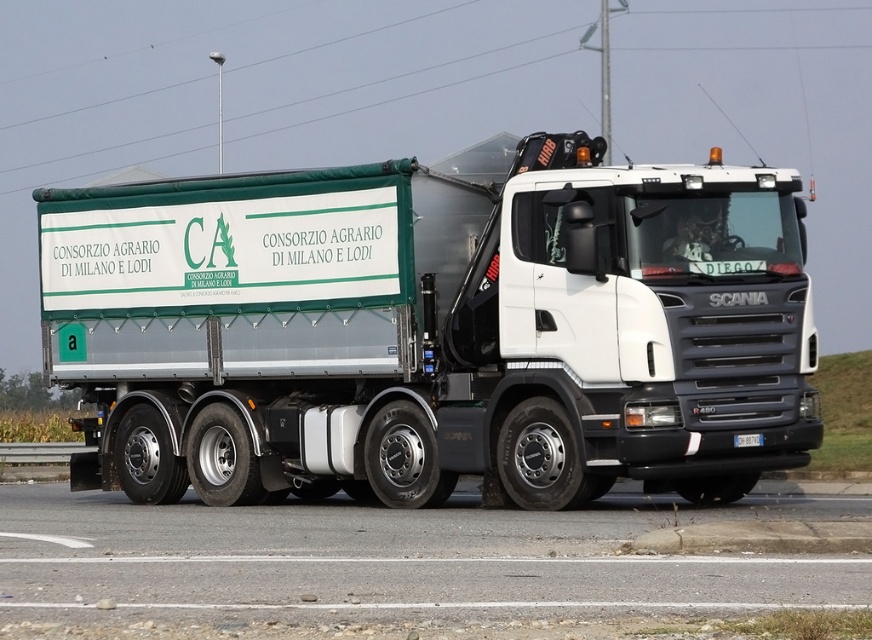
Question: Which of the following is the closest to the observer?

Choices:
 (A) white metallic trailer truck at center
 (B) gray asphalt road at lower center

Answer: (B)

Question: Which of the following is the closest to the observer?

Choices:
 (A) (806, 577)
 (B) (392, 257)

Answer: (A)

Question: Does white metallic trailer truck at center appear over gray asphalt road at lower center?

Choices:
 (A) yes
 (B) no

Answer: (A)

Question: Where is white metallic trailer truck at center located in relation to gray asphalt road at lower center in the image?

Choices:
 (A) left
 (B) right

Answer: (A)

Question: Does white metallic trailer truck at center have a lesser width compared to gray asphalt road at lower center?

Choices:
 (A) no
 (B) yes

Answer: (B)